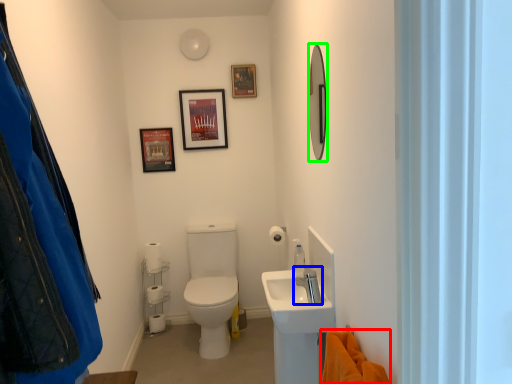
Question: Which is farther away from blanket (highlighted by a red box)? tap (highlighted by a blue box) or mirror (highlighted by a green box)?

Choices:
 (A) tap
 (B) mirror

Answer: (B)